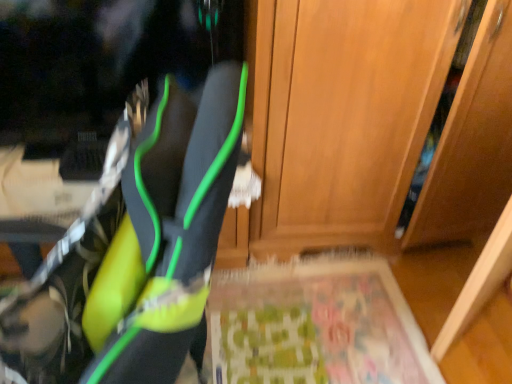
Question: Is wooden door at center thinner than green fabric yoga mat at lower center?

Choices:
 (A) no
 (B) yes

Answer: (B)

Question: Can you confirm if wooden door at center is positioned to the left of green fabric yoga mat at lower center?

Choices:
 (A) yes
 (B) no

Answer: (B)

Question: Is wooden door at center not within green fabric yoga mat at lower center?

Choices:
 (A) no
 (B) yes

Answer: (B)

Question: Can you confirm if wooden door at center is taller than green fabric yoga mat at lower center?

Choices:
 (A) yes
 (B) no

Answer: (A)

Question: Would you say wooden door at center is a long distance from green fabric yoga mat at lower center?

Choices:
 (A) yes
 (B) no

Answer: (B)

Question: From the image's perspective, is neon yellow fabric shoe at left above or below wooden door at center?

Choices:
 (A) below
 (B) above

Answer: (A)

Question: From a real-world perspective, is neon yellow fabric shoe at left positioned above or below wooden door at center?

Choices:
 (A) below
 (B) above

Answer: (B)

Question: Considering their positions, is neon yellow fabric shoe at left located in front of or behind wooden door at center?

Choices:
 (A) behind
 (B) front

Answer: (B)

Question: Is neon yellow fabric shoe at left situated inside wooden door at center or outside?

Choices:
 (A) outside
 (B) inside

Answer: (A)

Question: From a real-world perspective, is green fabric yoga mat at lower center positioned above or below neon yellow fabric shoe at left?

Choices:
 (A) above
 (B) below

Answer: (B)

Question: In terms of width, does green fabric yoga mat at lower center look wider or thinner when compared to neon yellow fabric shoe at left?

Choices:
 (A) wide
 (B) thin

Answer: (A)

Question: In terms of size, does green fabric yoga mat at lower center appear bigger or smaller than neon yellow fabric shoe at left?

Choices:
 (A) small
 (B) big

Answer: (A)

Question: In the image, is green fabric yoga mat at lower center positioned in front of or behind neon yellow fabric shoe at left?

Choices:
 (A) behind
 (B) front

Answer: (A)

Question: Is green fabric yoga mat at lower center taller or shorter than wooden door at center?

Choices:
 (A) short
 (B) tall

Answer: (A)

Question: From the image's perspective, is green fabric yoga mat at lower center above or below wooden door at center?

Choices:
 (A) below
 (B) above

Answer: (A)